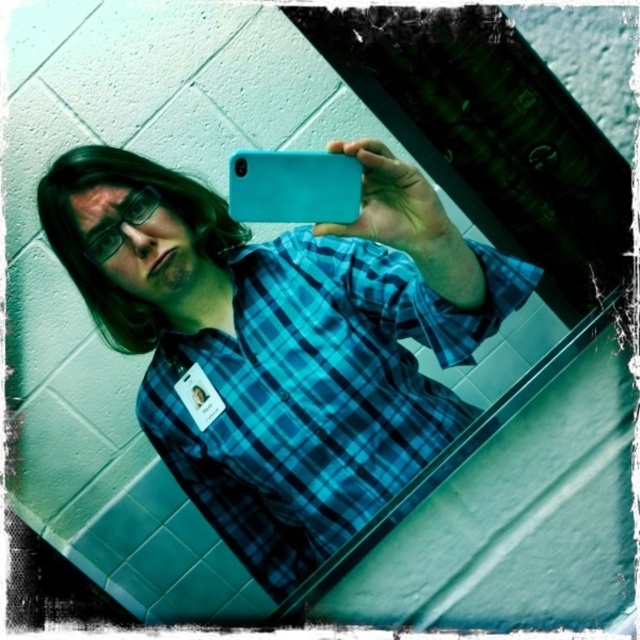
Does blue plaid shirt at center come in front of teal matte phone at center?

That is False.

Which is more to the left, blue plaid shirt at center or teal matte phone at center?

From the viewer's perspective, teal matte phone at center appears more on the left side.

Who is more distant from viewer, (371, 376) or (260, 208)?

The point (371, 376) is more distant.

Where is `blue plaid shirt at center`? Image resolution: width=640 pixels, height=640 pixels. blue plaid shirt at center is located at coordinates (316, 394).